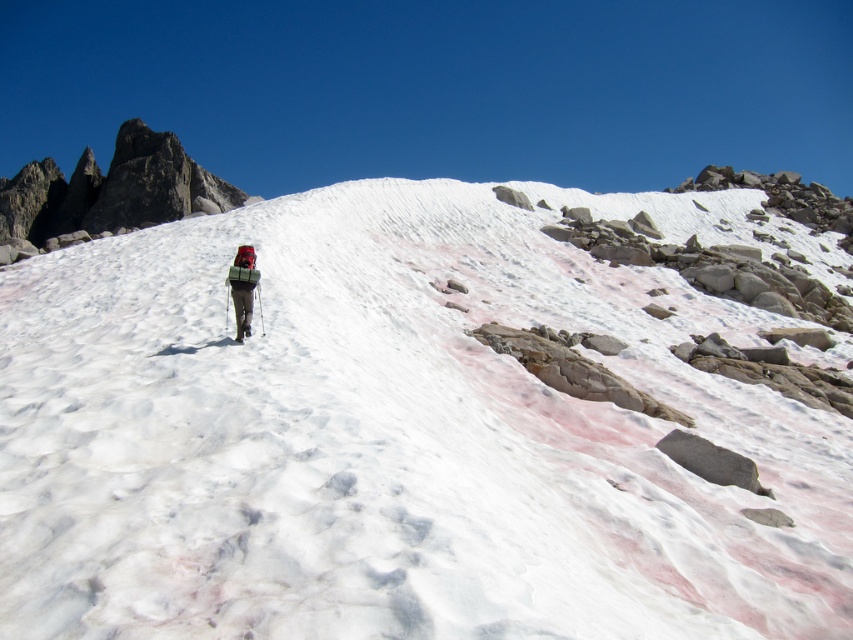
You are a hiker trying to navigate the snowy mountain slope. You see the white powdery snow at center and the green fabric backpack at center. Which object is taller from your perspective?

The white powdery snow at center is taller than the green fabric backpack at center according to the description.

You are a drone operator planning to fly a drone over the snowy mountain slope shown in the image. The drone has a maximum flight distance of 20 meters from its starting position. If you take off from the camera position, will the drone be able to reach point [381,278] without exceeding its maximum range?

The distance between point [381,278] and the camera is 18.66 meters, which is within the drone maximum flight range of 20 meters. Therefore, the drone can reach point [381,278] without exceeding its maximum range.